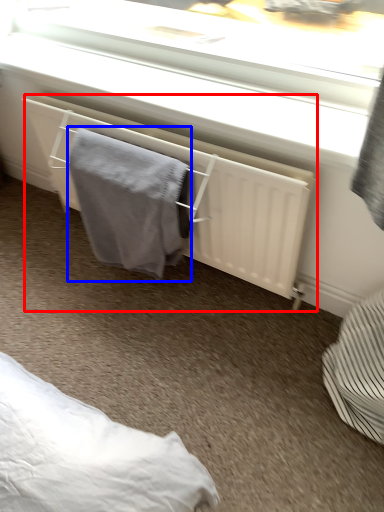
Question: Which object is closer to the camera taking this photo, radiator (highlighted by a red box) or bath towel (highlighted by a blue box)?

Choices:
 (A) radiator
 (B) bath towel

Answer: (A)